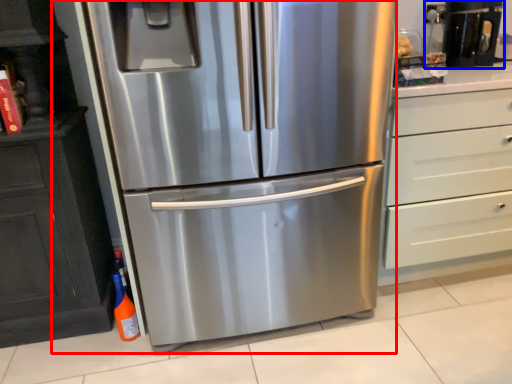
Question: Which point is closer to the camera, refrigerator (highlighted by a red box) or coffee machine (highlighted by a blue box)?

Choices:
 (A) refrigerator
 (B) coffee machine

Answer: (A)